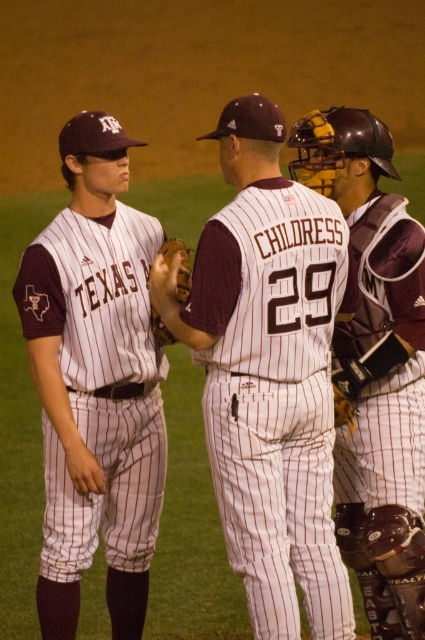
Question: Can you confirm if maroon leather catcher's gear at right is positioned to the left of brown leather glove at center?

Choices:
 (A) yes
 (B) no

Answer: (B)

Question: Is white pinstriped jersey at center to the left of white pinstriped uniform at center from the viewer's perspective?

Choices:
 (A) yes
 (B) no

Answer: (B)

Question: Which point appears farthest from the camera in this image?

Choices:
 (A) (289, 346)
 (B) (155, 308)
 (C) (408, 356)

Answer: (B)

Question: Can you confirm if white pinstriped jersey at center is bigger than maroon leather catcher's gear at right?

Choices:
 (A) yes
 (B) no

Answer: (A)

Question: Which point is farther to the camera?

Choices:
 (A) white pinstriped uniform at center
 (B) white pinstriped jersey at center
 (C) brown leather glove at center

Answer: (C)

Question: Which of the following is the farthest from the observer?

Choices:
 (A) white pinstriped uniform at center
 (B) brown leather glove at center

Answer: (B)